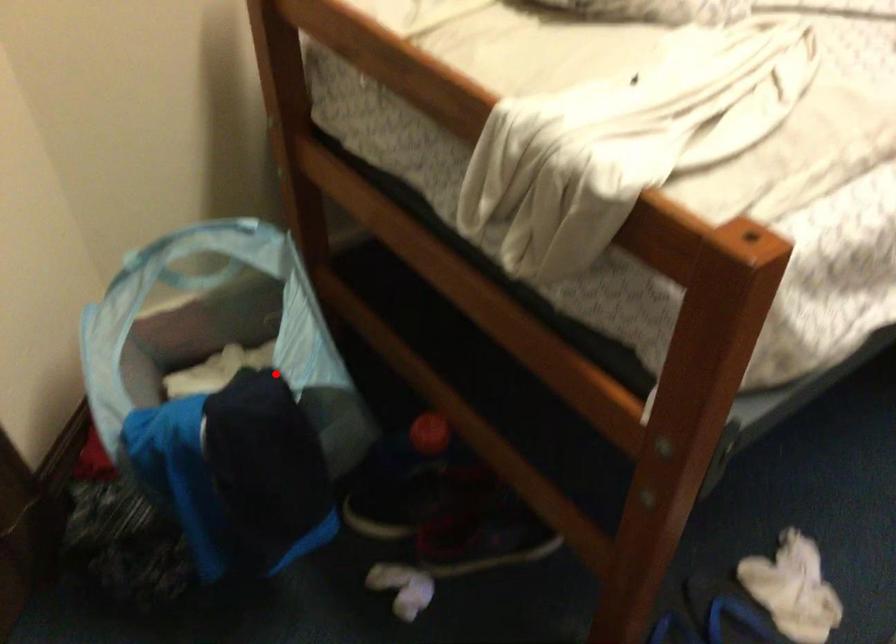
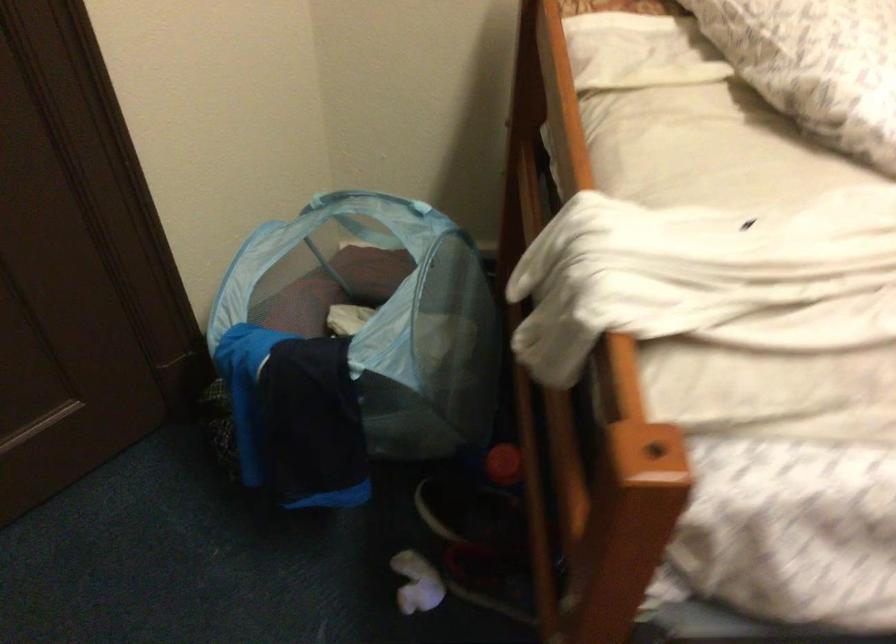
Find the pixel in the second image that matches the highlighted location in the first image.

(354, 345)